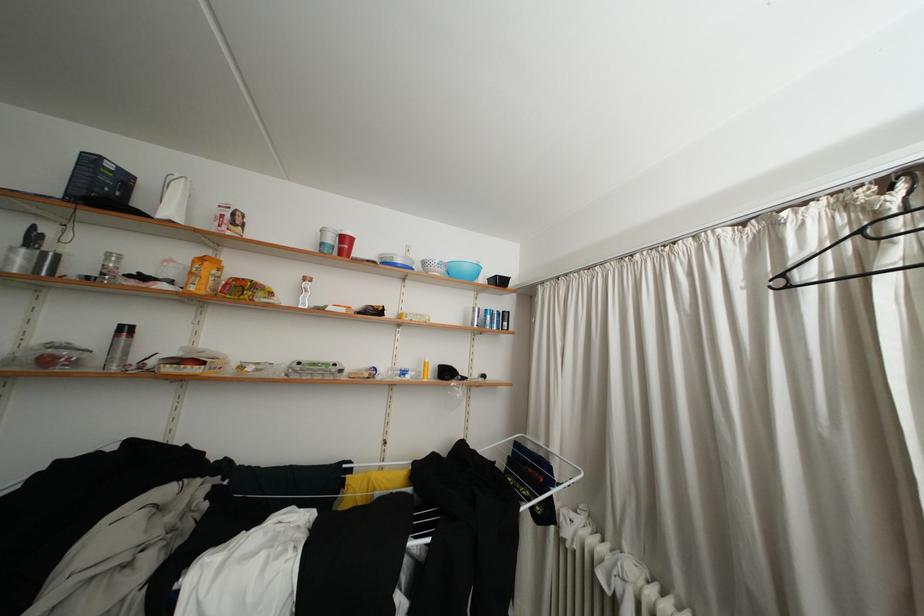
The location [203,275] corresponds to which object?

This point indicates the yellow plastic bottle.